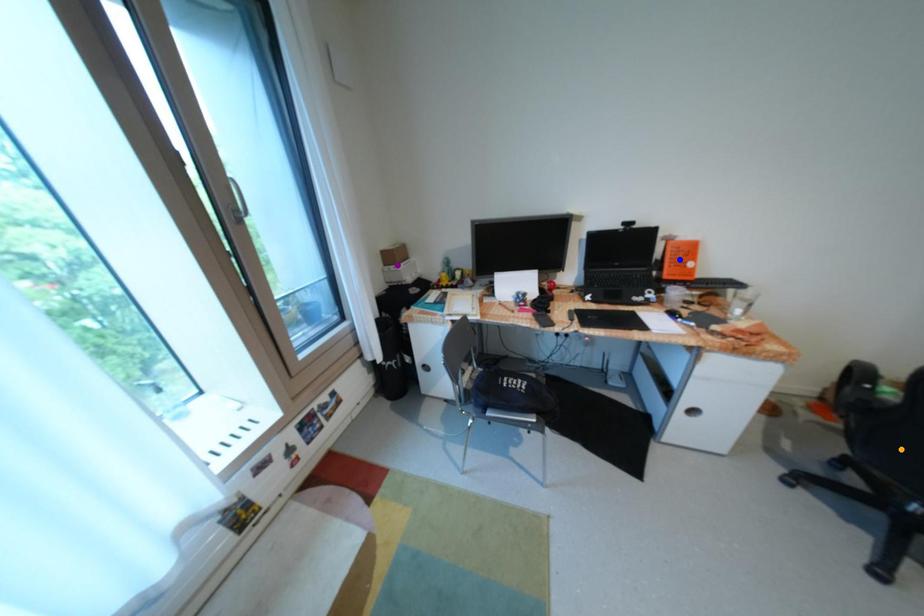
Order these from nearest to farthest:
- purple point
- orange point
- blue point

orange point < blue point < purple point